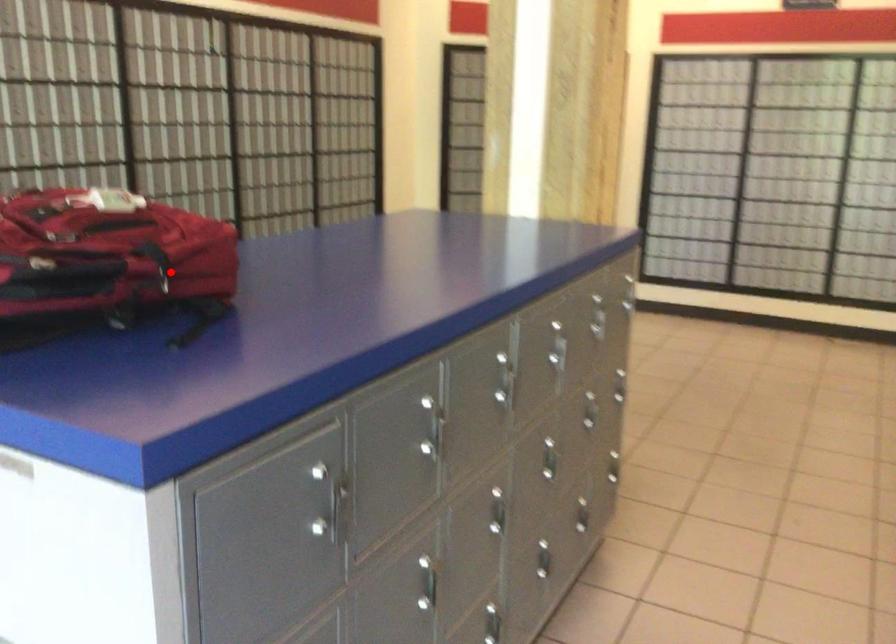
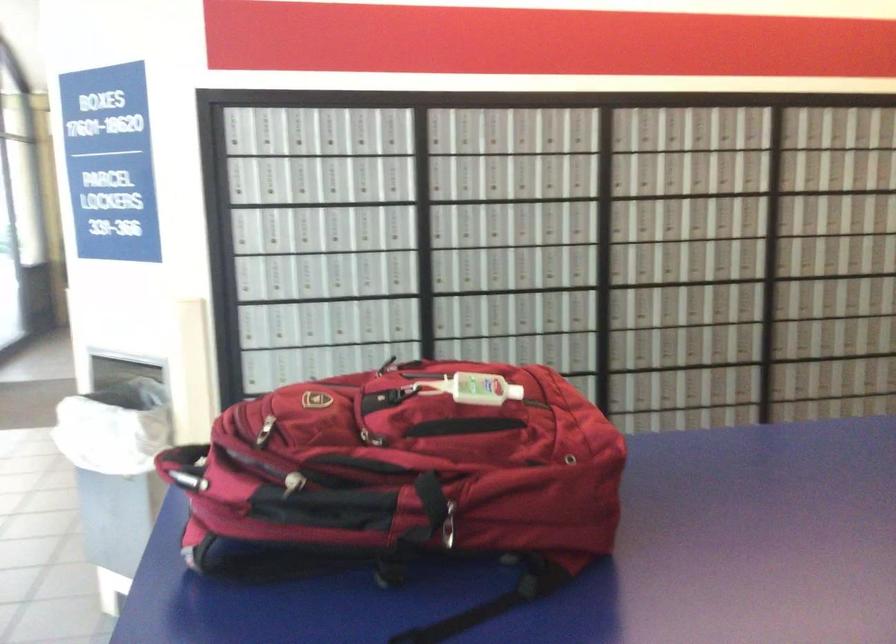
Question: A red point is marked in image1. In image2, is the corresponding 3D point closer to the camera or farther? Reply with the corresponding letter.

Choices:
 (A) The corresponding 3D point is closer.
 (B) The corresponding 3D point is farther.

Answer: (A)